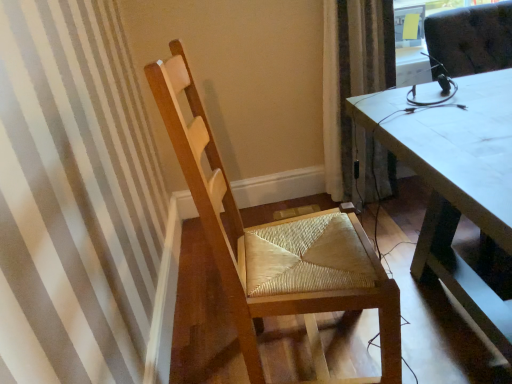
Question: From the image's perspective, is brown textured curtain at upper right above or below natural wood chair at left?

Choices:
 (A) below
 (B) above

Answer: (B)

Question: Based on their sizes in the image, would you say brown textured curtain at upper right is bigger or smaller than natural wood chair at left?

Choices:
 (A) big
 (B) small

Answer: (B)

Question: Is point coord(339,74) positioned closer to the camera than point coord(247,279)?

Choices:
 (A) farther
 (B) closer

Answer: (A)

Question: From the image's perspective, is natural wood chair at left positioned above or below brown textured curtain at upper right?

Choices:
 (A) above
 (B) below

Answer: (B)

Question: Based on their positions, is natural wood chair at left located to the left or right of brown textured curtain at upper right?

Choices:
 (A) left
 (B) right

Answer: (A)

Question: In the image, is natural wood chair at left positioned in front of or behind brown textured curtain at upper right?

Choices:
 (A) behind
 (B) front

Answer: (B)

Question: Is natural wood chair at left bigger or smaller than brown textured curtain at upper right?

Choices:
 (A) small
 (B) big

Answer: (B)